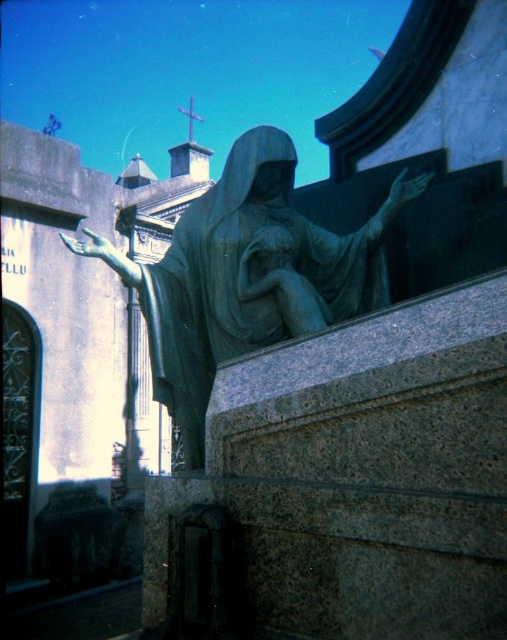
You are standing in a cemetery and see the green patina statue at center and the bronze statue at center. Which one is positioned to the left?

The green patina statue at center is positioned to the left of the bronze statue at center.

You are standing in front of a tombstone in a cemetery and see the green patina statue at center and the bronze statue at center. Which one is nearer to you?

The green patina statue at center is closer to the viewer than the bronze statue at center.

You are an art conservator examining the cemetery scene. You notice two statues at the center. One is labeled as the green patina statue at center and the other as the bronze statue at center. Which of these two statues is larger in size?

The green patina statue at center is bigger than the bronze statue at center.